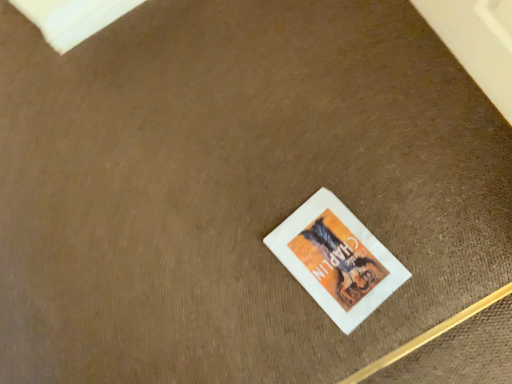
Locate an element on the screen. The width and height of the screenshot is (512, 384). vacant space behind white paper book at center is located at coordinates (274, 184).